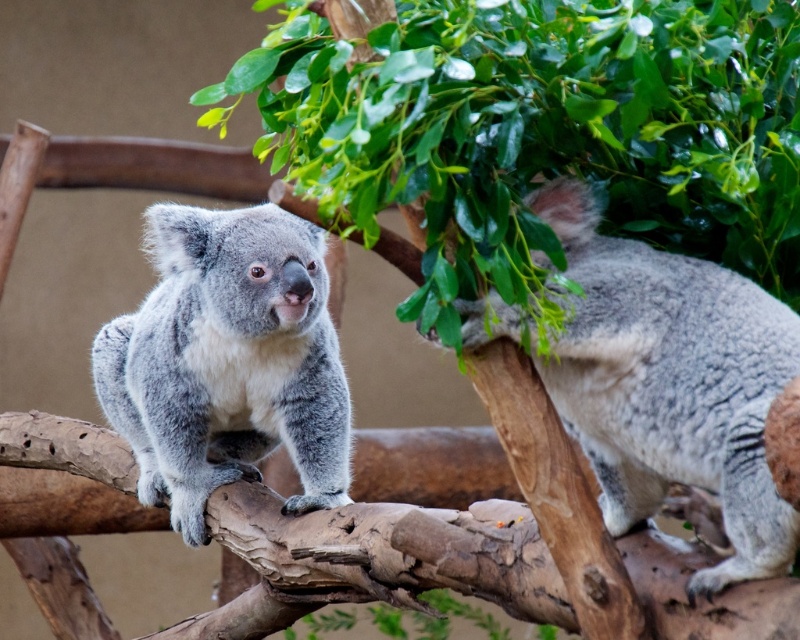
Who is positioned more to the right, gray fluffy koala at right or gray fluffy koala at center?

Positioned to the right is gray fluffy koala at right.

Who is positioned more to the left, gray fluffy koala at right or gray fluffy koala at center?

gray fluffy koala at center is more to the left.

Locate an element on the screen. The image size is (800, 640). gray fluffy koala at right is located at coordinates (670, 381).

Where is `gray fluffy koala at right`? This screenshot has width=800, height=640. gray fluffy koala at right is located at coordinates (670, 381).